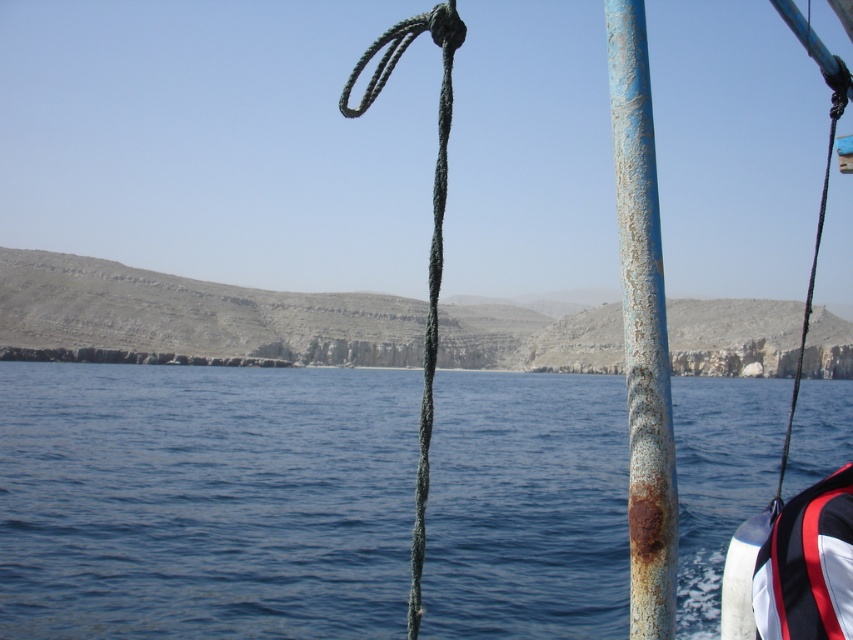
Measure the distance between white/red fabric life jacket at lower right and camera.

white/red fabric life jacket at lower right is 12.03 meters away from camera.

Between white/red fabric life jacket at lower right and green rough rope at center, which one has more height?

green rough rope at center

This screenshot has width=853, height=640. I want to click on white/red fabric life jacket at lower right, so click(x=808, y=564).

Can you confirm if white/red fabric life jacket at lower right is taller than green rope at right?

In fact, white/red fabric life jacket at lower right may be shorter than green rope at right.

Who is positioned more to the right, white/red fabric life jacket at lower right or green rope at right?

green rope at right is more to the right.

Image resolution: width=853 pixels, height=640 pixels. What do you see at coordinates (808, 564) in the screenshot?
I see `white/red fabric life jacket at lower right` at bounding box center [808, 564].

The height and width of the screenshot is (640, 853). Find the location of `white/red fabric life jacket at lower right`. white/red fabric life jacket at lower right is located at coordinates (808, 564).

Locate an element on the screen. blue water at center is located at coordinates (204, 500).

Who is positioned more to the right, blue water at center or green rope at right?

From the viewer's perspective, green rope at right appears more on the right side.

You are a GUI agent. You are given a task and a screenshot of the screen. Output one action in this format:
    pyautogui.click(x=<x>, y=<y>)
    Task: Click on the blue water at center
    The height and width of the screenshot is (640, 853).
    Given the screenshot: What is the action you would take?
    pyautogui.click(x=204, y=500)